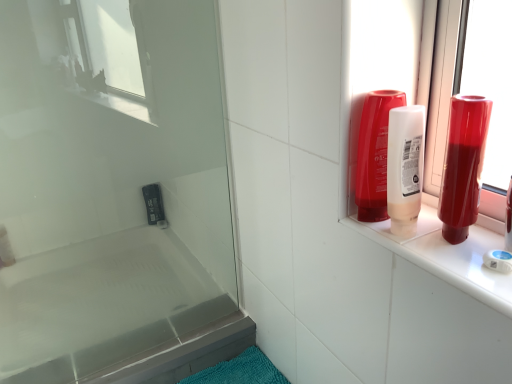
Question: Is point (361, 135) closer or farther from the camera than point (12, 253)?

Choices:
 (A) closer
 (B) farther

Answer: (A)

Question: Is translucent plastic mouthwash at upper right, which appears as the second mouthwash when viewed from the right, taller or shorter than translucent plastic soap at lower left?

Choices:
 (A) short
 (B) tall

Answer: (B)

Question: Based on their relative distances, which object is farther from the translucent plastic mouthwash at upper right, which appears as the second mouthwash when viewed from the right?

Choices:
 (A) transparent glass screen door at upper left
 (B) white glossy bathtub at lower left
 (C) translucent plastic soap at lower left
 (D) shiny red bottle at right, which ranks as the second mouthwash in left-to-right order

Answer: (B)

Question: Considering the real-world distances, which object is farthest from the translucent plastic soap at lower left?

Choices:
 (A) shiny red bottle at right, the first mouthwash viewed from the right
 (B) translucent plastic mouthwash at upper right, which appears as the second mouthwash when viewed from the right
 (C) transparent glass screen door at upper left
 (D) white glossy bathtub at lower left

Answer: (A)